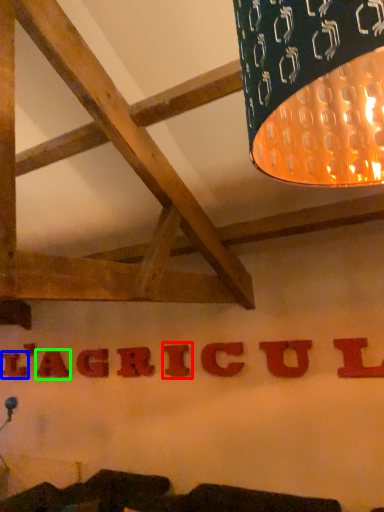
Question: Which object is the closest to the letter (highlighted by a red box)? Choose among these: letter (highlighted by a blue box) or letter (highlighted by a green box).

Choices:
 (A) letter
 (B) letter

Answer: (B)